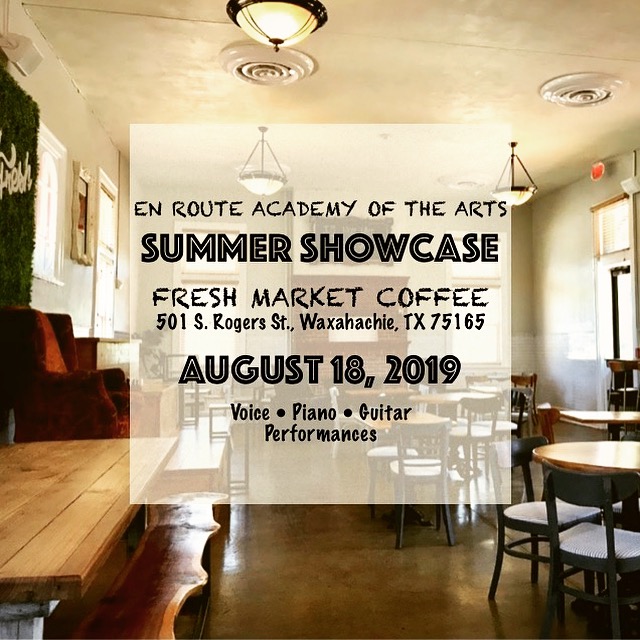
Locate an element on the screen. The height and width of the screenshot is (640, 640). concrete floor is located at coordinates (349, 587).